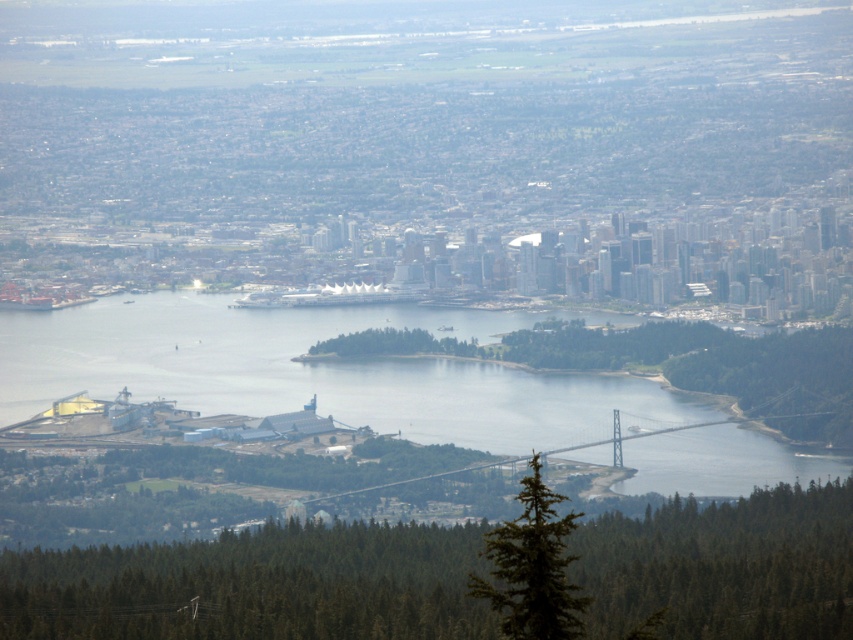
Question: Can you confirm if green textured tree at lower center is bigger than green textured tree at lower right?

Choices:
 (A) no
 (B) yes

Answer: (B)

Question: Which object is closer to the camera taking this photo?

Choices:
 (A) green textured tree at lower center
 (B) clear water at lower center

Answer: (B)

Question: Can you confirm if green textured tree at lower center is positioned to the left of clear water at lower center?

Choices:
 (A) yes
 (B) no

Answer: (A)

Question: Which is farther from the green textured tree at lower center?

Choices:
 (A) clear water at lower center
 (B) green textured tree at lower right

Answer: (A)

Question: Among these points, which one is farthest from the camera?

Choices:
 (A) (700, 538)
 (B) (520, 451)

Answer: (A)

Question: Can you confirm if green textured tree at lower center is positioned below clear water at lower center?

Choices:
 (A) no
 (B) yes

Answer: (B)